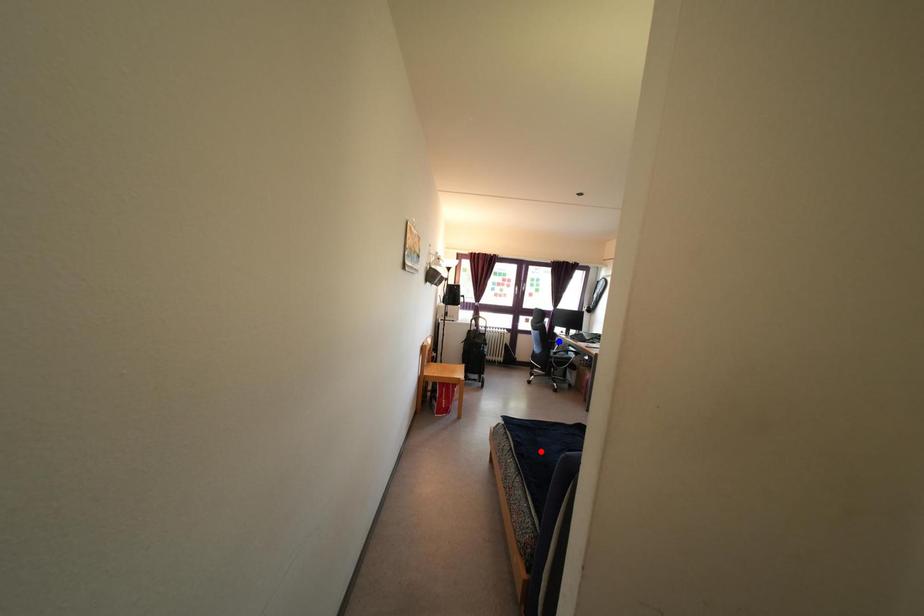
Question: Two points are marked on the image. Which point is closer to the camera?

Choices:
 (A) Blue point is closer.
 (B) Red point is closer.

Answer: (B)